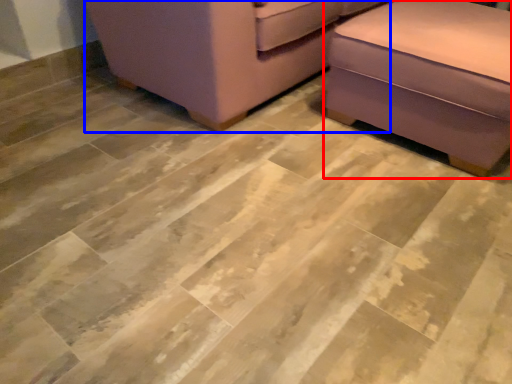
Question: Which object appears farthest to the camera in this image, furniture (highlighted by a red box) or furniture (highlighted by a blue box)?

Choices:
 (A) furniture
 (B) furniture

Answer: (B)